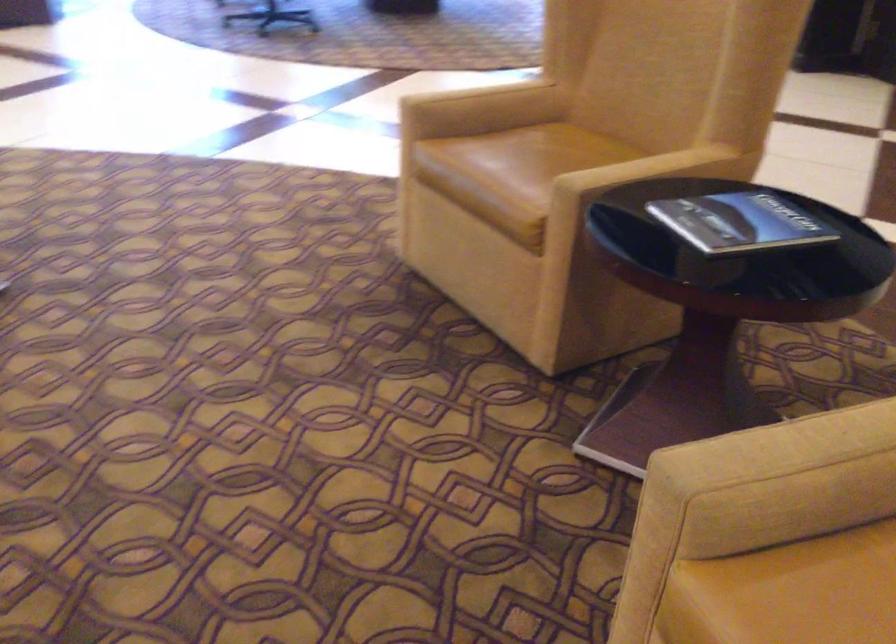
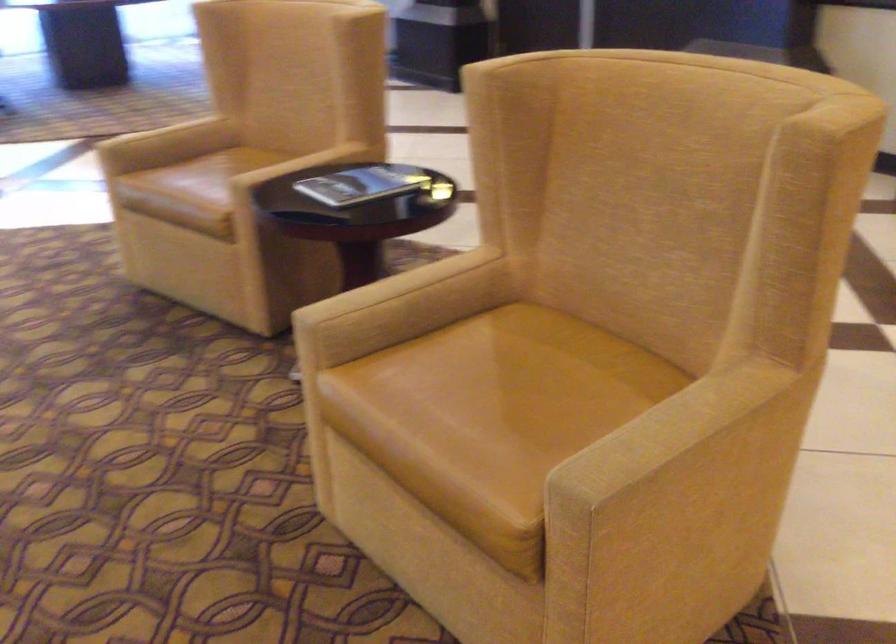
Question: What movement of the cameraman would produce the second image?

Choices:
 (A) Left
 (B) Right
 (C) Forward
 (D) Backward

Answer: (D)